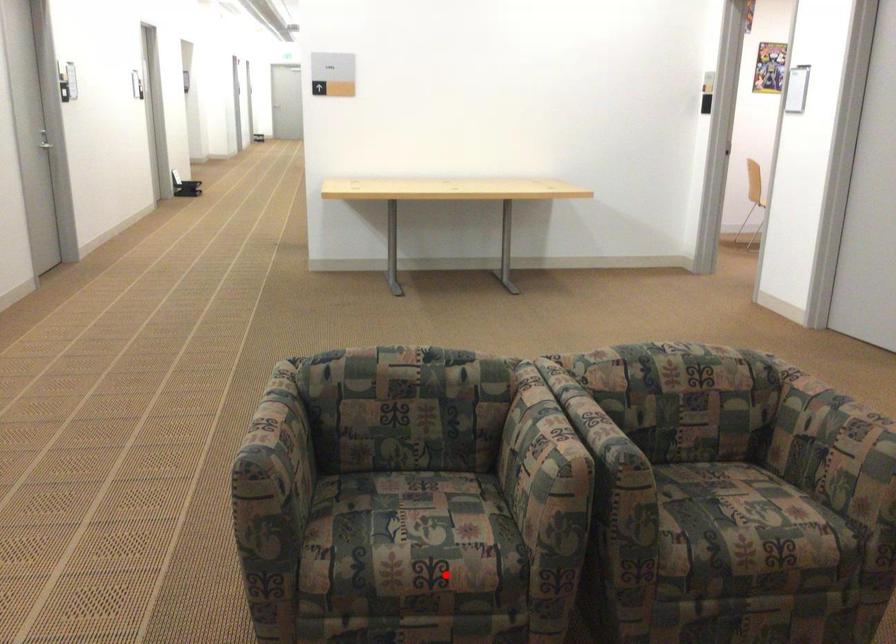
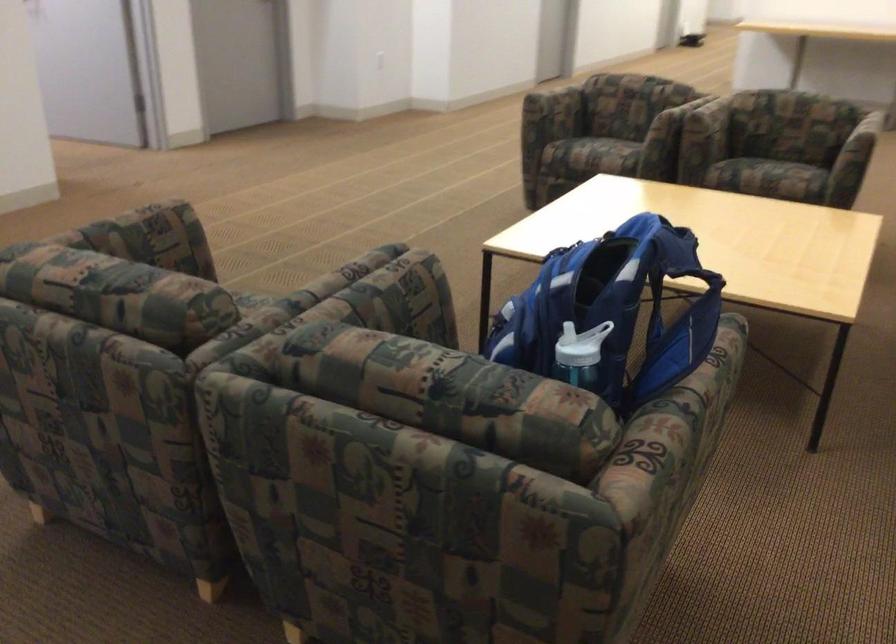
Where in the second image is the point corresponding to the highlighted location from the first image?

(597, 152)